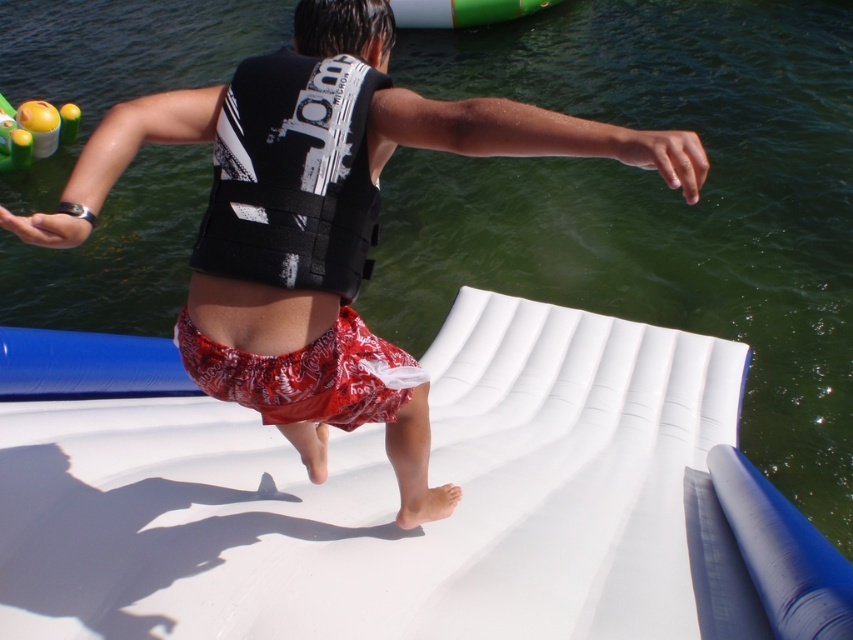
Does white rubber boat at center appear over red printed shorts at center?

Incorrect, white rubber boat at center is not positioned above red printed shorts at center.

Which is behind, point (119, 381) or point (350, 400)?

The point (119, 381) is behind.

Is point (262, 435) closer to camera compared to point (288, 358)?

No, (262, 435) is behind (288, 358).

Where is `white rubber boat at center`? The image size is (853, 640). white rubber boat at center is located at coordinates (395, 497).

Consider the image. Is matte black life vest at center thinner than black matte life jacket at center?

Incorrect, matte black life vest at center's width is not less than black matte life jacket at center's.

This screenshot has width=853, height=640. What do you see at coordinates (523, 134) in the screenshot?
I see `matte black life vest at center` at bounding box center [523, 134].

Where is `matte black life vest at center`? The image size is (853, 640). matte black life vest at center is located at coordinates (523, 134).

Image resolution: width=853 pixels, height=640 pixels. Describe the element at coordinates (523, 134) in the screenshot. I see `matte black life vest at center` at that location.

In order to click on matte black life vest at center in this screenshot , I will do `click(523, 134)`.

Is point (216, 332) behind point (254, 378)?

No, it is in front of (254, 378).

I want to click on matte black life vest at center, so click(523, 134).